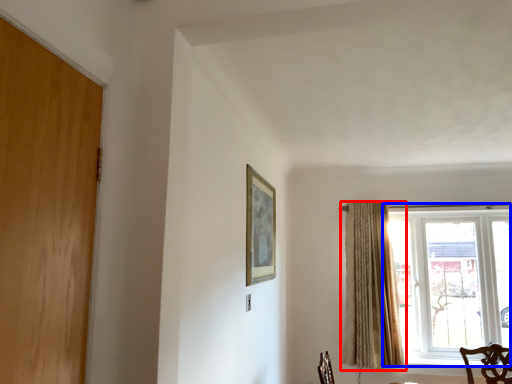
Question: Which object is further to the camera taking this photo, curtain (highlighted by a red box) or window (highlighted by a blue box)?

Choices:
 (A) curtain
 (B) window

Answer: (B)